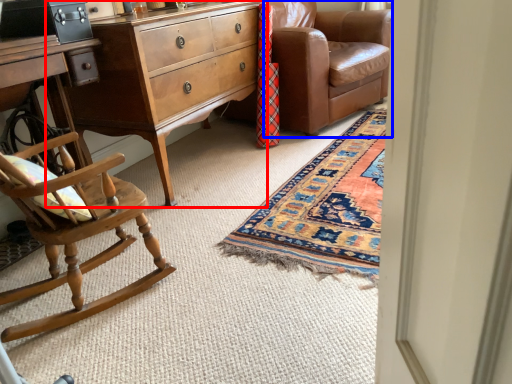
Question: Which object is closer to the camera taking this photo, nightstand (highlighted by a red box) or studio couch (highlighted by a blue box)?

Choices:
 (A) nightstand
 (B) studio couch

Answer: (A)